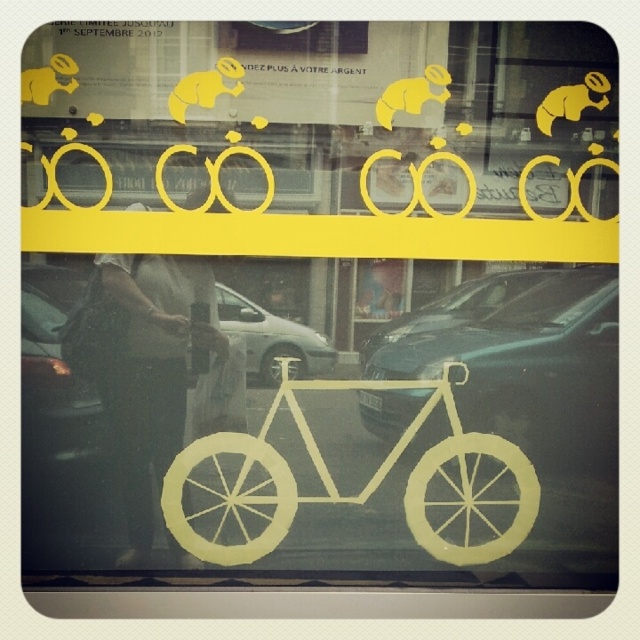
Question: Can you confirm if metallic silver bicycle at center is positioned to the right of matte black car at center?

Choices:
 (A) no
 (B) yes

Answer: (B)

Question: Is silver metallic car at center wider than yellow matte animal at upper center?

Choices:
 (A) yes
 (B) no

Answer: (A)

Question: Based on their relative distances, which object is farther from the metallic silver bicycle at center?

Choices:
 (A) matte yellow bear at center
 (B) yellow matte animal at upper right

Answer: (A)

Question: Does silver metallic car at center appear on the left side of yellow matte animal at upper center?

Choices:
 (A) no
 (B) yes

Answer: (A)

Question: Which object appears closest to the camera in this image?

Choices:
 (A) matte yellow bear at center
 (B) yellow matte animal at upper center
 (C) metallic silver bicycle at center

Answer: (B)

Question: Which point is farther to the camera?

Choices:
 (A) metallic silver bicycle at center
 (B) matte yellow bear at center
 (C) yellow matte bicycle at center
 (D) yellow matte animal at upper center

Answer: (C)